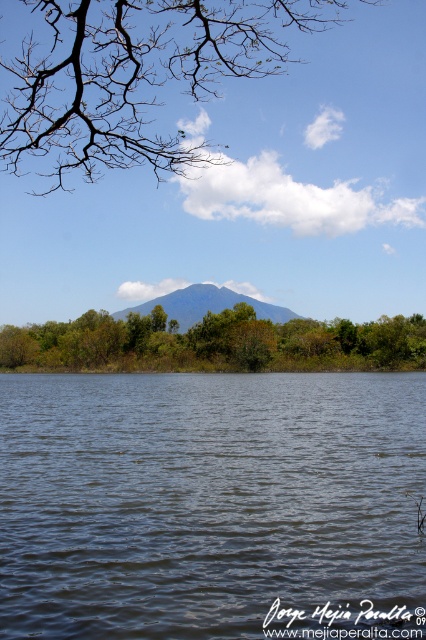
Looking at this image, which is more to the left, transparent water at center or green leafy trees at center?

From the viewer's perspective, green leafy trees at center appears more on the left side.

Is point (65, 381) positioned in front of point (221, 316)?

Yes, it is in front of point (221, 316).

Where is `transparent water at center`? The width and height of the screenshot is (426, 640). transparent water at center is located at coordinates point(204,499).

At what (x,y) coordinates should I click in order to perform the action: click on transparent water at center. Please return your answer as a coordinate pair (x, y). The image size is (426, 640). Looking at the image, I should click on coord(204,499).

Which of these two, green leafy trees at center or gray/volcanic rock mountain at center, stands shorter?

green leafy trees at center is shorter.

Between green leafy trees at center and gray/volcanic rock mountain at center, which one appears on the left side from the viewer's perspective?

Positioned to the left is green leafy trees at center.

At what (x,y) coordinates should I click in order to perform the action: click on green leafy trees at center. Please return your answer as a coordinate pair (x, y). The height and width of the screenshot is (640, 426). Looking at the image, I should click on (215, 342).

Is point (362, 483) positioned behind point (209, 300)?

No, (362, 483) is closer to viewer.

Does transparent water at center have a smaller size compared to gray/volcanic rock mountain at center?

Correct, transparent water at center occupies less space than gray/volcanic rock mountain at center.

Does point (302, 493) lie behind point (287, 316)?

No.

Identify the location of transparent water at center. (204, 499).